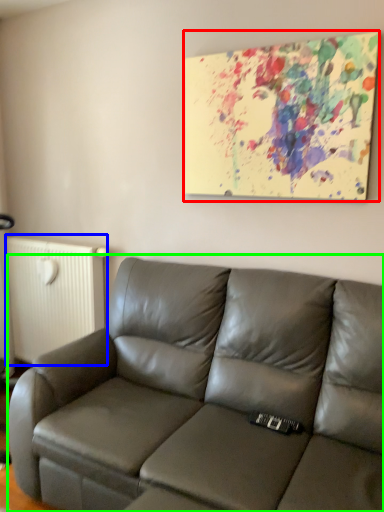
Question: Based on their relative distances, which object is farther from picture frame (highlighted by a red box)? Choose from radiator (highlighted by a blue box) and studio couch (highlighted by a green box).

Choices:
 (A) radiator
 (B) studio couch

Answer: (A)